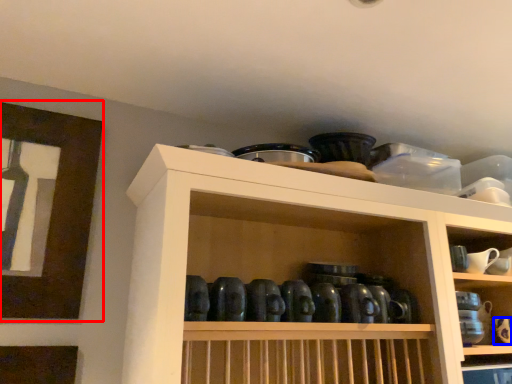
Question: Which of the following is the closest to the observer, picture frame (highlighted by a red box) or tableware (highlighted by a blue box)?

Choices:
 (A) picture frame
 (B) tableware

Answer: (A)